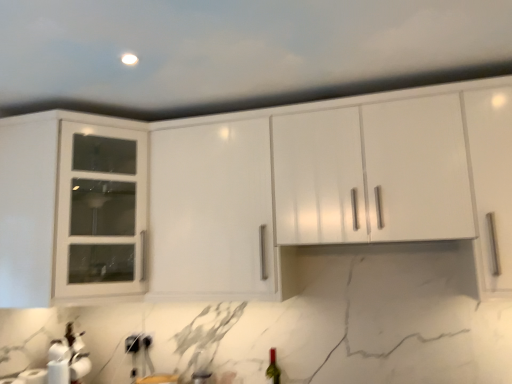
Question: Is green glass wine bottle at lower center positioned in front of white glass cabinet at upper left?

Choices:
 (A) no
 (B) yes

Answer: (A)

Question: From a real-world perspective, does green glass wine bottle at lower center stand above white glass cabinet at upper left?

Choices:
 (A) no
 (B) yes

Answer: (A)

Question: Is green glass wine bottle at lower center oriented away from white glass cabinet at upper left?

Choices:
 (A) no
 (B) yes

Answer: (A)

Question: Considering the relative positions of green glass wine bottle at lower center and white glass cabinet at upper left in the image provided, is green glass wine bottle at lower center behind white glass cabinet at upper left?

Choices:
 (A) no
 (B) yes

Answer: (B)

Question: Is green glass wine bottle at lower center surrounding white glass cabinet at upper left?

Choices:
 (A) no
 (B) yes

Answer: (A)

Question: Are green glass wine bottle at lower center and white glass cabinet at upper left making contact?

Choices:
 (A) no
 (B) yes

Answer: (A)

Question: Is green glass wine bottle at lower center facing away from white matte paper towel at lower left?

Choices:
 (A) yes
 (B) no

Answer: (B)

Question: Can you confirm if green glass wine bottle at lower center is shorter than white matte paper towel at lower left?

Choices:
 (A) no
 (B) yes

Answer: (A)

Question: Is green glass wine bottle at lower center wider than white matte paper towel at lower left?

Choices:
 (A) yes
 (B) no

Answer: (B)

Question: Is green glass wine bottle at lower center in contact with white matte paper towel at lower left?

Choices:
 (A) yes
 (B) no

Answer: (B)

Question: Is green glass wine bottle at lower center smaller than white matte paper towel at lower left?

Choices:
 (A) yes
 (B) no

Answer: (A)

Question: Could you tell me if green glass wine bottle at lower center is facing white matte paper towel at lower left?

Choices:
 (A) yes
 (B) no

Answer: (B)

Question: From the image's perspective, would you say white glass cabinet at upper left is positioned over white matte paper towel at lower left?

Choices:
 (A) yes
 (B) no

Answer: (A)